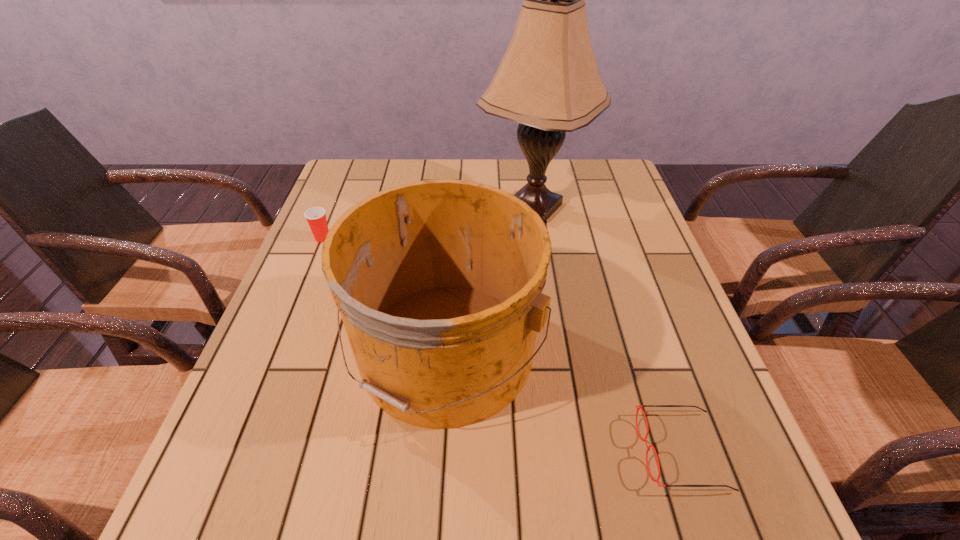
The height and width of the screenshot is (540, 960). What are the coordinates of `the tallest object` in the screenshot? It's located at (548, 81).

The width and height of the screenshot is (960, 540). In order to click on the second tallest object in this screenshot , I will do (x=439, y=283).

Where is `Dixie cup`? Image resolution: width=960 pixels, height=540 pixels. Dixie cup is located at coordinates click(316, 217).

This screenshot has width=960, height=540. I want to click on the third tallest object, so click(316, 217).

Where is `the shortest object`? The height and width of the screenshot is (540, 960). the shortest object is located at coordinates [x=640, y=406].

Locate an element on the screen. This screenshot has width=960, height=540. free space located on the left of the tallest object is located at coordinates (380, 207).

Find the location of a particular element. The width and height of the screenshot is (960, 540). vacant position located 0.330m on the right of the third shortest object is located at coordinates (695, 351).

Where is `free location located on the right of the third tallest object`? This screenshot has width=960, height=540. free location located on the right of the third tallest object is located at coordinates (373, 238).

The width and height of the screenshot is (960, 540). In order to click on free region located on the front-facing side of the spectacles in this screenshot , I will do `click(463, 451)`.

Find the location of a particular element. This screenshot has height=540, width=960. free spot located 0.190m on the front-facing side of the spectacles is located at coordinates (532, 451).